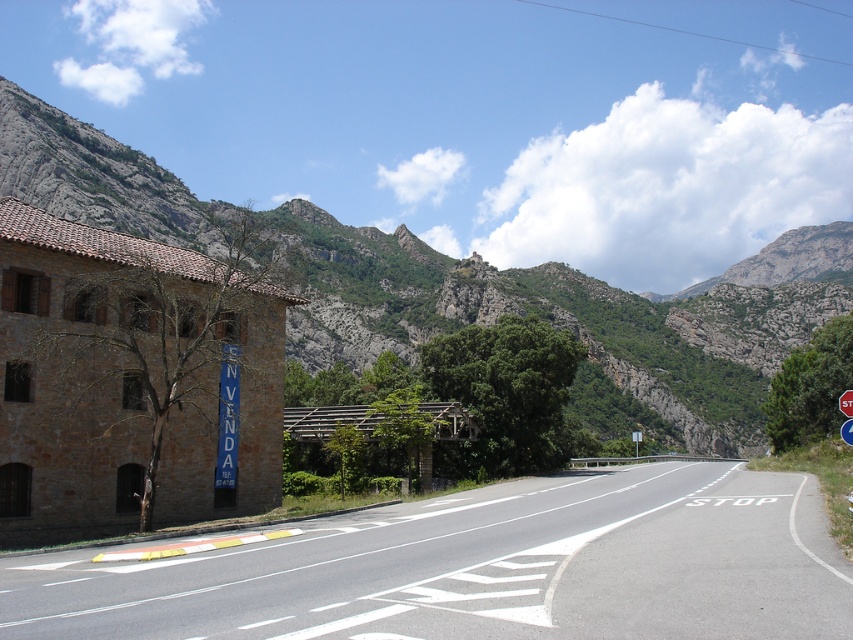
Question: Which object is closer to the camera taking this photo?

Choices:
 (A) rugged stone mountain at upper center
 (B) metallic blue stop sign at right

Answer: (B)

Question: Which object appears farthest from the camera in this image?

Choices:
 (A) asphalt road at center
 (B) rugged stone mountain at upper center

Answer: (B)

Question: Is rugged stone mountain at upper center wider than metallic blue stop sign at right?

Choices:
 (A) no
 (B) yes

Answer: (B)

Question: Does asphalt road at center come behind metallic blue stop sign at right?

Choices:
 (A) no
 (B) yes

Answer: (A)

Question: In this image, where is asphalt road at center located relative to metallic blue stop sign at right?

Choices:
 (A) left
 (B) right

Answer: (A)

Question: Which point appears closest to the camera in this image?

Choices:
 (A) (850, 422)
 (B) (494, 544)
 (C) (379, 243)

Answer: (A)